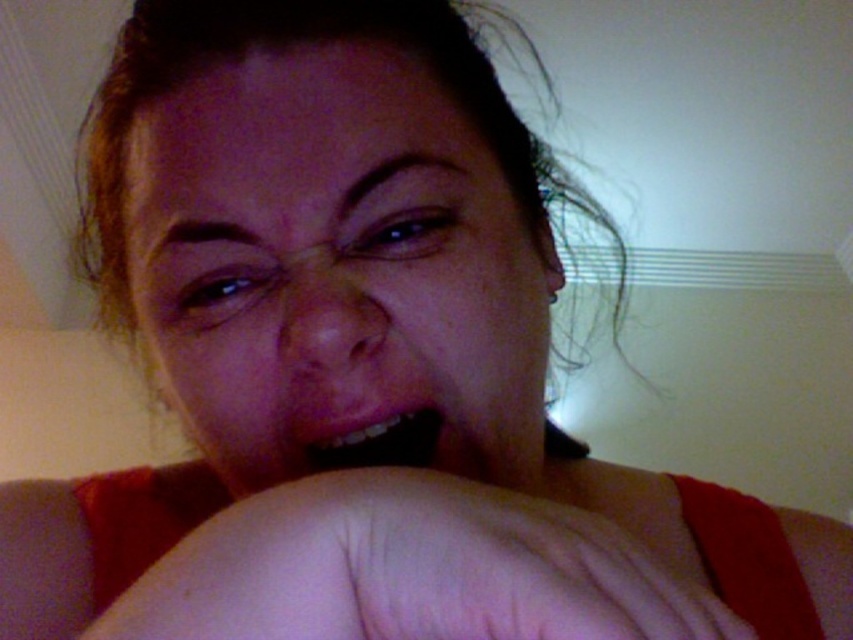
Can you confirm if smooth skin at center is shorter than pink matte lips at center?

In fact, smooth skin at center may be taller than pink matte lips at center.

Who is more distant from viewer, [419,618] or [392,416]?

The point [392,416] is more distant.

At what (x,y) coordinates should I click in order to perform the action: click on smooth skin at center. Please return your answer as a coordinate pair (x, y). The height and width of the screenshot is (640, 853). Looking at the image, I should click on pos(412,570).